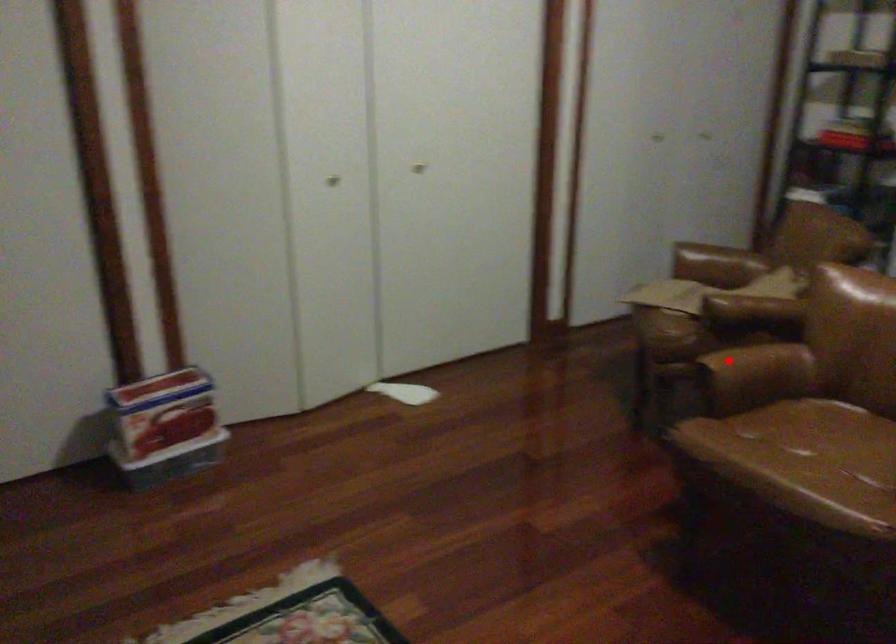
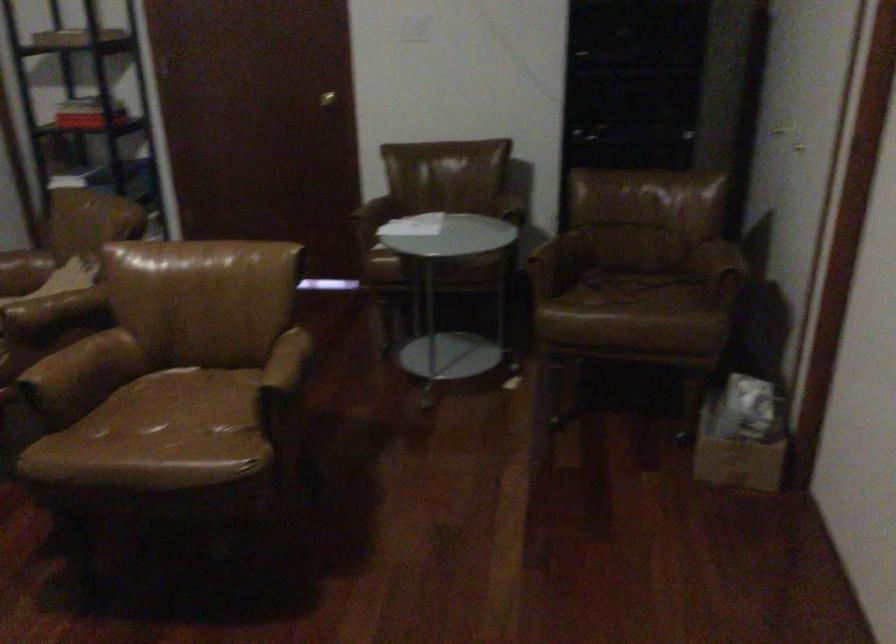
Where in the second image is the point corresponding to the highlighted location from the first image?

(61, 361)